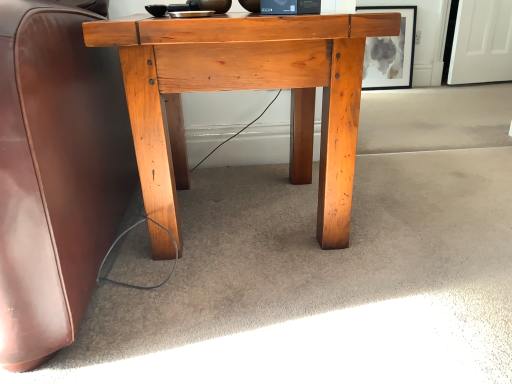
What are the coordinates of `free space underneath natural wood desk at center (from a real-world perspective)` in the screenshot? It's located at (245, 218).